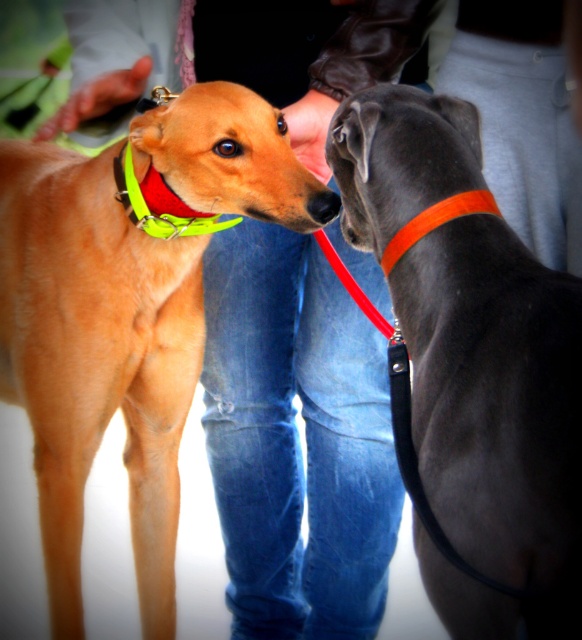
Question: Considering the real-world distances, which object is farthest from the shiny black dog at right?

Choices:
 (A) green fabric neckband at left
 (B) orange fabric neckband at right

Answer: (A)

Question: From the image, what is the correct spatial relationship of orange fabric neckband at right in relation to neon yellow fabric neckband at left?

Choices:
 (A) right
 (B) left

Answer: (A)

Question: Can you confirm if neon yellow fabric neckband at left is positioned to the left of black rubber nose at center?

Choices:
 (A) yes
 (B) no

Answer: (A)

Question: Which point is closer to the camera?

Choices:
 (A) neon yellow fabric neckband at left
 (B) orange fabric neckband at right

Answer: (B)

Question: Which point is closer to the camera?

Choices:
 (A) (417, 195)
 (B) (331, 200)
 (C) (172, 193)

Answer: (A)

Question: Does shiny black dog at right appear on the left side of neon yellow fabric neckband at left?

Choices:
 (A) no
 (B) yes

Answer: (A)